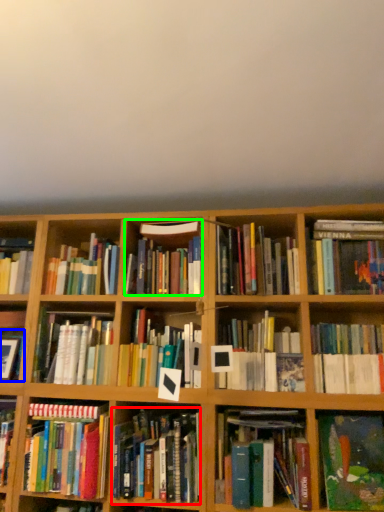
Question: Which object is positioned closest to book (highlighted by a red box)? Select from book (highlighted by a blue box) and book (highlighted by a green box).

Choices:
 (A) book
 (B) book

Answer: (B)